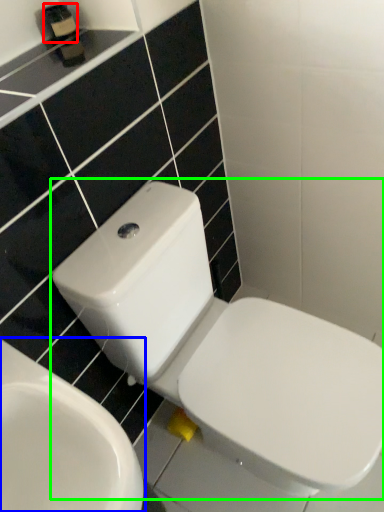
Question: Considering the real-world distances, which object is farthest from toiletry (highlighted by a red box)? toilet (highlighted by a blue box) or toilet (highlighted by a green box)?

Choices:
 (A) toilet
 (B) toilet

Answer: (A)